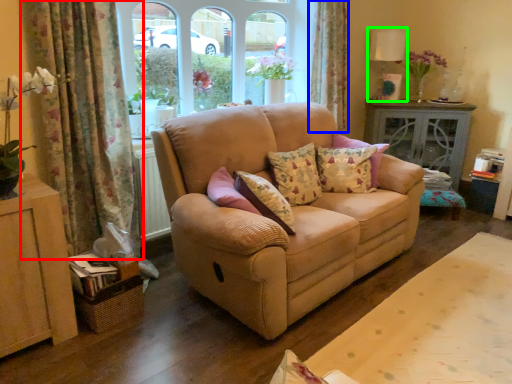
Question: Based on their relative distances, which object is nearer to curtain (highlighted by a red box)? Choose from curtain (highlighted by a blue box) and lamp (highlighted by a green box).

Choices:
 (A) curtain
 (B) lamp

Answer: (A)